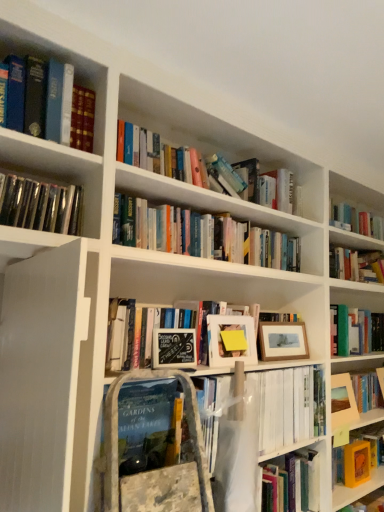
Question: Are matte white picture frame at center, which is counted as the 1th picture frame, starting from the left, and wooden picture frame at center-right, acting as the 2th picture frame starting from the left, making contact?

Choices:
 (A) yes
 (B) no

Answer: (B)

Question: Could you tell me if matte white picture frame at center, marked as the third picture frame in a bottom-to-top arrangement, is facing wooden picture frame at center-right, which is the second picture frame from back to front?

Choices:
 (A) no
 (B) yes

Answer: (A)

Question: Is matte white picture frame at center, marked as the third picture frame in a bottom-to-top arrangement, wider than wooden picture frame at center-right, the second picture frame when ordered from front to back?

Choices:
 (A) no
 (B) yes

Answer: (A)

Question: Is matte white picture frame at center, marked as the 3th picture frame in a right-to-left arrangement, at the left side of wooden picture frame at center-right, the 2th picture frame from the right?

Choices:
 (A) no
 (B) yes

Answer: (B)

Question: Would you say matte white picture frame at center, which is counted as the 1th picture frame, starting from the left, is outside wooden picture frame at center-right, which is the second picture frame from back to front?

Choices:
 (A) yes
 (B) no

Answer: (A)

Question: From a real-world perspective, is matte white picture frame at center, marked as the third picture frame in a bottom-to-top arrangement, located beneath wooden picture frame at center-right, acting as the 2th picture frame starting from the left?

Choices:
 (A) no
 (B) yes

Answer: (A)

Question: Can black chalkboard sign at center, which is the second paperback book in right-to-left order, be found inside matte white picture frame at center, marked as the third picture frame in a bottom-to-top arrangement?

Choices:
 (A) yes
 (B) no

Answer: (B)

Question: Is black chalkboard sign at center, which is the 2th paperback book in bottom-to-top order, at the back of matte white picture frame at center, the first picture frame from the front?

Choices:
 (A) no
 (B) yes

Answer: (A)

Question: Does matte white picture frame at center, which is counted as the 1th picture frame, starting from the left, have a greater width compared to black chalkboard sign at center, the second paperback book in the back-to-front sequence?

Choices:
 (A) yes
 (B) no

Answer: (A)

Question: Is matte white picture frame at center, which is the 1th picture frame from top to bottom, positioned beyond the bounds of black chalkboard sign at center, which is the 2th paperback book in bottom-to-top order?

Choices:
 (A) yes
 (B) no

Answer: (A)

Question: Does matte white picture frame at center, the first picture frame from the front, have a lesser height compared to black chalkboard sign at center, the first paperback book viewed from the left?

Choices:
 (A) no
 (B) yes

Answer: (A)

Question: From the image's perspective, is matte white picture frame at center, which is counted as the 1th picture frame, starting from the left, beneath black chalkboard sign at center, which ranks as the first paperback book in top-to-bottom order?

Choices:
 (A) yes
 (B) no

Answer: (B)

Question: From a real-world perspective, is black chalkboard sign at center, the second paperback book in the back-to-front sequence, located beneath wooden picture frame at center-right, acting as the 2th picture frame starting from the left?

Choices:
 (A) no
 (B) yes

Answer: (B)